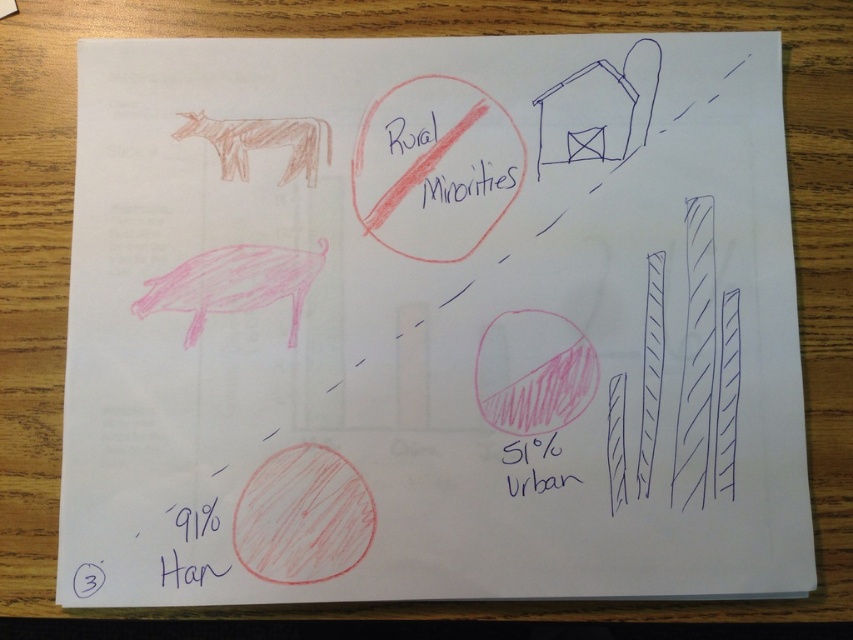
Question: Is black handwritten text at lower left above pink handwritten text at lower center?

Choices:
 (A) no
 (B) yes

Answer: (A)

Question: Can you confirm if black ink text at center is positioned to the left of pink handwritten text at lower center?

Choices:
 (A) yes
 (B) no

Answer: (A)

Question: Which point is farther to the camera?

Choices:
 (A) (189, 529)
 (B) (508, 451)

Answer: (B)

Question: Which of these objects is positioned farthest from the black ink text at center?

Choices:
 (A) pink handwritten text at lower center
 (B) black handwritten text at lower left

Answer: (B)

Question: Among these objects, which one is farthest from the camera?

Choices:
 (A) pink handwritten text at lower center
 (B) black handwritten text at lower left
 (C) black ink text at center

Answer: (C)

Question: From the image, what is the correct spatial relationship of black handwritten text at lower left in relation to black ink text at center?

Choices:
 (A) below
 (B) above

Answer: (A)